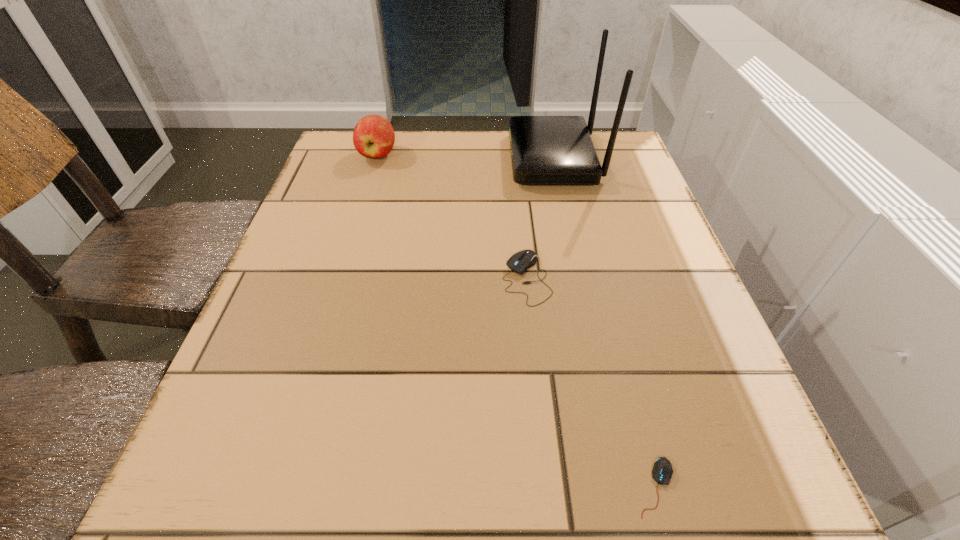
Locate an element on the screen. The image size is (960, 540). free space between the router and the leftmost object is located at coordinates (466, 157).

Identify the location of empty space that is in between the shorter mouse and the second shortest object. This screenshot has height=540, width=960. (591, 383).

I want to click on vacant area that lies between the left mouse and the leftmost object, so click(x=452, y=217).

Locate an element on the screen. vacant region between the leftmost object and the nearer mouse is located at coordinates (516, 321).

At what (x,y) coordinates should I click in order to perform the action: click on free spot between the farther mouse and the leftmost object. Please return your answer as a coordinate pair (x, y). The height and width of the screenshot is (540, 960). Looking at the image, I should click on (452, 217).

Where is `vacant space that's between the taller mouse and the leftmost object`? The height and width of the screenshot is (540, 960). vacant space that's between the taller mouse and the leftmost object is located at coordinates (452, 217).

I want to click on vacant space in between the apple and the tallest object, so click(466, 157).

This screenshot has height=540, width=960. I want to click on free spot between the tallest object and the apple, so tap(466, 157).

Select which object appears as the closest to the nearest object. Please provide its 2D coordinates. Your answer should be formatted as a tuple, i.e. [(x, y)], where the tuple contains the x and y coordinates of a point satisfying the conditions above.

[(521, 261)]

Where is `the closest object to the right mouse`? The height and width of the screenshot is (540, 960). the closest object to the right mouse is located at coordinates (521, 261).